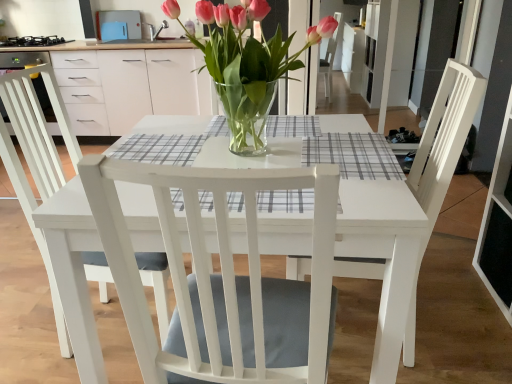
Question: Are gray checkered placemat at center, which is the second plaid from front to back, and white wood chair at center, the first chair positioned from the right, located far from each other?

Choices:
 (A) yes
 (B) no

Answer: (B)

Question: Does gray checkered placemat at center, marked as the 2th plaid in a bottom-to-top arrangement, have a larger size compared to white wood chair at center, the 2th chair positioned from the left?

Choices:
 (A) yes
 (B) no

Answer: (B)

Question: From the image's perspective, is gray checkered placemat at center, the 1th plaid positioned from the top, below white wood chair at center, the first chair positioned from the right?

Choices:
 (A) no
 (B) yes

Answer: (A)

Question: Can white wood chair at center, the 2th chair positioned from the left, be found inside gray checkered placemat at center, marked as the 2th plaid in a bottom-to-top arrangement?

Choices:
 (A) yes
 (B) no

Answer: (B)

Question: Considering the relative positions of gray checkered placemat at center, which is the second plaid from front to back, and white wood chair at center, the 2th chair positioned from the left, in the image provided, is gray checkered placemat at center, which is the second plaid from front to back, to the right of white wood chair at center, the 2th chair positioned from the left, from the viewer's perspective?

Choices:
 (A) yes
 (B) no

Answer: (B)

Question: Can we say gray checkered placemat at center, marked as the 2th plaid in a bottom-to-top arrangement, lies outside white wood chair at center, the first chair positioned from the right?

Choices:
 (A) yes
 (B) no

Answer: (B)

Question: From a real-world perspective, is clear glass vase at center located higher than gray checkered placemat at center, which is the second plaid from front to back?

Choices:
 (A) no
 (B) yes

Answer: (B)

Question: Could you tell me if clear glass vase at center is facing gray checkered placemat at center, which is counted as the first plaid, starting from the right?

Choices:
 (A) no
 (B) yes

Answer: (A)

Question: Is clear glass vase at center completely or partially outside of gray checkered placemat at center, which is the first plaid in back-to-front order?

Choices:
 (A) no
 (B) yes

Answer: (B)

Question: From a real-world perspective, is clear glass vase at center under gray checkered placemat at center, the 1th plaid positioned from the top?

Choices:
 (A) no
 (B) yes

Answer: (A)

Question: Does clear glass vase at center come in front of gray checkered placemat at center, which is the first plaid in back-to-front order?

Choices:
 (A) no
 (B) yes

Answer: (B)

Question: Considering the relative positions of clear glass vase at center and gray checkered placemat at center, which is the first plaid in back-to-front order, in the image provided, is clear glass vase at center behind gray checkered placemat at center, which is the first plaid in back-to-front order,?

Choices:
 (A) no
 (B) yes

Answer: (A)

Question: Can you confirm if black matte stove at upper left is wider than white wood chair at center, positioned as the second chair in right-to-left order?

Choices:
 (A) no
 (B) yes

Answer: (A)